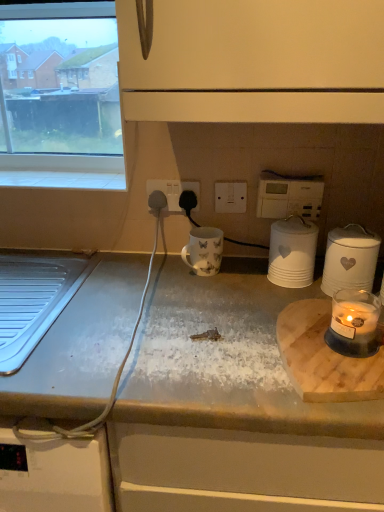
Image resolution: width=384 pixels, height=512 pixels. Identify the location of vacant area on top of white marble countertop at center (from a real-world perspective). (249, 321).